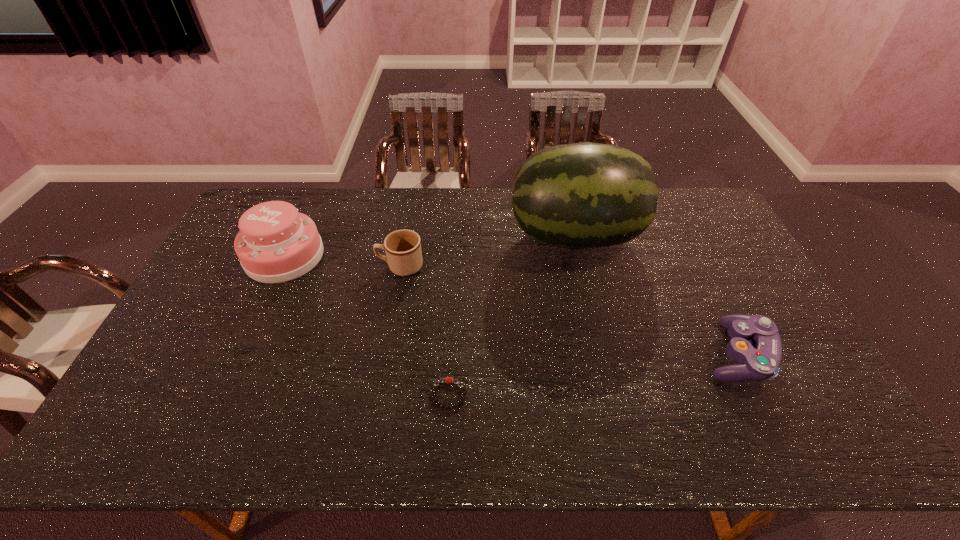
Where is `vacant region at the right edge of the desktop`? This screenshot has width=960, height=540. vacant region at the right edge of the desktop is located at coordinates (752, 295).

In the image, there is a desktop. What are the coordinates of `vacant space at the far left corner` in the screenshot? It's located at (283, 195).

I want to click on free space at the near left corner of the desktop, so click(153, 426).

Image resolution: width=960 pixels, height=540 pixels. In the image, there is a desktop. In order to click on vacant space at the near right corner in this screenshot , I will do `click(806, 448)`.

The height and width of the screenshot is (540, 960). What are the coordinates of `empty space between the second object from right to left and the control` in the screenshot? It's located at (656, 295).

Where is `free point between the fourth object from left to right and the fourth object from right to left`? free point between the fourth object from left to right and the fourth object from right to left is located at coordinates (488, 252).

The height and width of the screenshot is (540, 960). Identify the location of free point between the second object from right to left and the fourth shortest object. (429, 246).

The height and width of the screenshot is (540, 960). Find the location of `free space between the birthday cake and the rightmost object`. free space between the birthday cake and the rightmost object is located at coordinates (511, 305).

You are a GUI agent. You are given a task and a screenshot of the screen. Output one action in this format:
    pyautogui.click(x=<x>, y=<y>)
    Task: Click on the free spot between the rightmost object and the third object from right to left
    This screenshot has height=540, width=960.
    Given the screenshot: What is the action you would take?
    pyautogui.click(x=592, y=374)

At what (x,y) coordinates should I click in order to perform the action: click on free area in between the leftmost object and the third object from left to right. Please return your answer as a coordinate pair (x, y). This screenshot has width=960, height=540. Looking at the image, I should click on (367, 325).